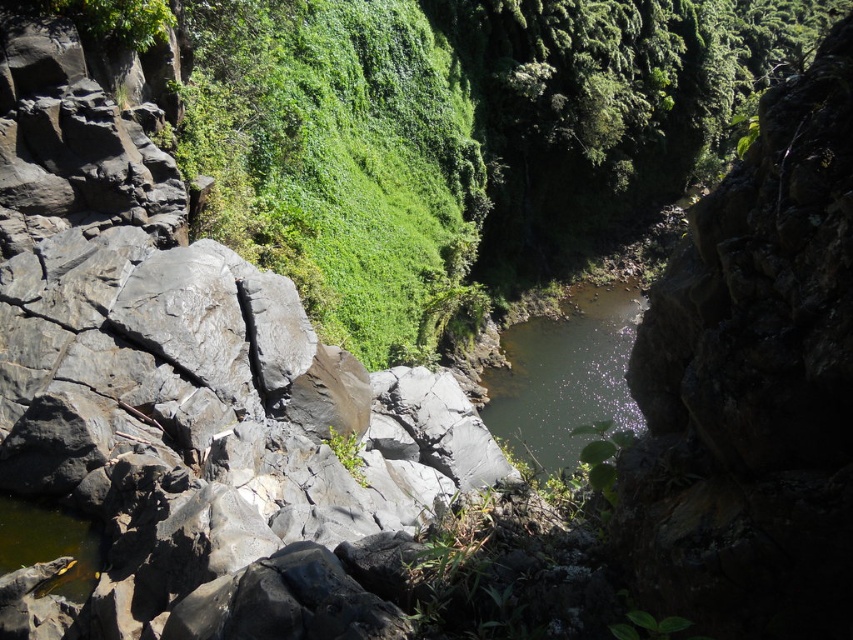
Question: Does green leafy vegetation at center have a larger size compared to greenish reflective water at center?

Choices:
 (A) no
 (B) yes

Answer: (B)

Question: Which object appears farthest from the camera in this image?

Choices:
 (A) green leafy vegetation at center
 (B) greenish reflective water at center

Answer: (B)

Question: Which point is farther to the camera?

Choices:
 (A) greenish reflective water at center
 (B) green leafy vegetation at center

Answer: (A)

Question: Does green leafy vegetation at center appear under greenish reflective water at center?

Choices:
 (A) no
 (B) yes

Answer: (A)

Question: Is green leafy vegetation at center wider than greenish reflective water at center?

Choices:
 (A) yes
 (B) no

Answer: (B)